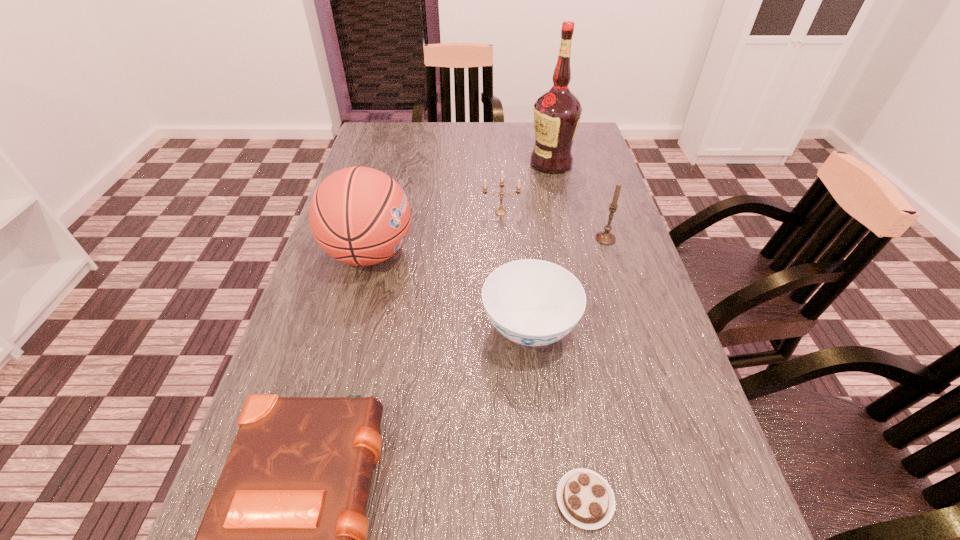
At what (x,y) coordinates should I click in order to perform the action: click on free point between the farthest object and the chinaware. Please return your answer as a coordinate pair (x, y). Looking at the image, I should click on (540, 246).

This screenshot has height=540, width=960. Find the location of `vacant area that lies between the second tallest object and the shortest object`. vacant area that lies between the second tallest object and the shortest object is located at coordinates (477, 376).

Where is `vacant area between the taller candle and the second tallest object`? This screenshot has height=540, width=960. vacant area between the taller candle and the second tallest object is located at coordinates (488, 246).

Identify the location of object that is the fifth closest to the sixth tallest object. point(605,237).

Find the location of a particular element. object that is the fourth closest to the basketball is located at coordinates (557, 112).

Image resolution: width=960 pixels, height=540 pixels. Find the location of `free space that satisfies the following two spatial constraints: 1. on the front side of the second farthest object; 2. on the right side of the fifth tallest object`. free space that satisfies the following two spatial constraints: 1. on the front side of the second farthest object; 2. on the right side of the fifth tallest object is located at coordinates (507, 328).

Image resolution: width=960 pixels, height=540 pixels. I want to click on free location that satisfies the following two spatial constraints: 1. on the logo side of the basketball; 2. on the right side of the chocolate cake, so click(304, 500).

This screenshot has width=960, height=540. Identify the location of free space that satisfies the following two spatial constraints: 1. on the front side of the shorter candle; 2. on the right side of the third shortest object. pyautogui.click(x=507, y=328).

Where is `free spot that satisfies the following two spatial constraints: 1. on the logo side of the basketball; 2. on the back side of the chocolate cake`? free spot that satisfies the following two spatial constraints: 1. on the logo side of the basketball; 2. on the back side of the chocolate cake is located at coordinates (x=304, y=500).

This screenshot has height=540, width=960. In order to click on vacant space that satisfies the following two spatial constraints: 1. on the label of the alcohol; 2. on the front side of the chocolate cake in this screenshot , I will do `click(624, 500)`.